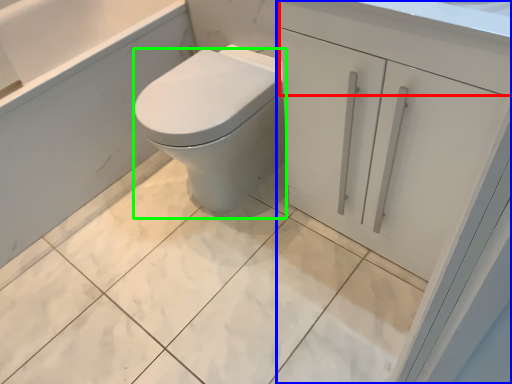
Question: Which object is positioned closest to drawer (highlighted by a red box)? Select from bathroom cabinet (highlighted by a blue box) and bidet (highlighted by a green box).

Choices:
 (A) bathroom cabinet
 (B) bidet

Answer: (A)